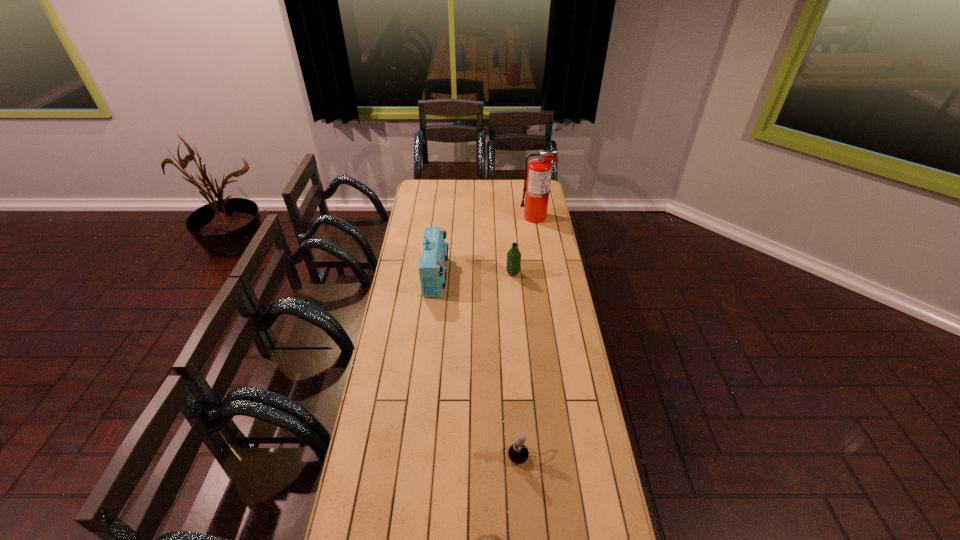
Locate an element on the screen. Image resolution: width=960 pixels, height=540 pixels. free space between the fourth farthest object and the fourth shortest object is located at coordinates (485, 366).

Image resolution: width=960 pixels, height=540 pixels. I want to click on blank region between the water bottle and the farthest object, so click(524, 245).

This screenshot has width=960, height=540. What are the coordinates of `vacant region between the radio receiver and the third shortest object` in the screenshot? It's located at (474, 275).

Image resolution: width=960 pixels, height=540 pixels. I want to click on free space between the water bottle and the fourth tallest object, so click(x=523, y=365).

Identify the location of free area in between the fire extinguisher and the microphone. (535, 337).

You are a GUI agent. You are given a task and a screenshot of the screen. Output one action in this format:
    pyautogui.click(x=<x>, y=<y>)
    Task: Click on the object that is the closest to the farthest object
    
    Given the screenshot: What is the action you would take?
    pyautogui.click(x=513, y=255)

You are a GUI agent. You are given a task and a screenshot of the screen. Output one action in this format:
    pyautogui.click(x=<x>, y=<y>)
    Task: Click on the third closest object to the second nearest object
    The width and height of the screenshot is (960, 540).
    Given the screenshot: What is the action you would take?
    pyautogui.click(x=513, y=255)

In order to click on blank area in the image that satisfies the following two spatial constraints: 1. on the front side of the third tallest object; 2. on the front-facing side of the fourth shortest object in this screenshot , I will do `click(513, 276)`.